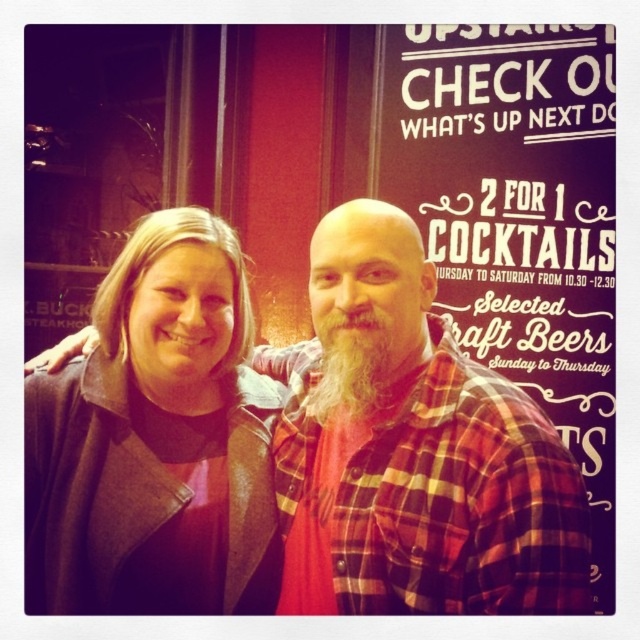
In the scene shown: Is dark brown leather jacket at center to the right of graywoollybeard at center from the viewer's perspective?

No, dark brown leather jacket at center is not to the right of graywoollybeard at center.

Is dark brown leather jacket at center above graywoollybeard at center?

Incorrect, dark brown leather jacket at center is not positioned above graywoollybeard at center.

Who is more distant from viewer, (x=68, y=529) or (x=316, y=387)?

Positioned behind is point (x=316, y=387).

Where is `dark brown leather jacket at center`? The width and height of the screenshot is (640, 640). dark brown leather jacket at center is located at coordinates (156, 438).

Can you confirm if plaid flannel shirt at center is bigger than graywoollybeard at center?

Yes, plaid flannel shirt at center is bigger than graywoollybeard at center.

Is plaid flannel shirt at center positioned before graywoollybeard at center?

That is True.

Identify the location of plaid flannel shirt at center. Image resolution: width=640 pixels, height=640 pixels. (413, 451).

Does plaid flannel shirt at center have a lesser height compared to dark brown leather jacket at center?

In fact, plaid flannel shirt at center may be taller than dark brown leather jacket at center.

Does plaid flannel shirt at center appear on the right side of dark brown leather jacket at center?

Indeed, plaid flannel shirt at center is positioned on the right side of dark brown leather jacket at center.

Is point (426, 518) closer to camera compared to point (150, 234)?

Yes.

Locate an element on the screen. The height and width of the screenshot is (640, 640). plaid flannel shirt at center is located at coordinates (413, 451).